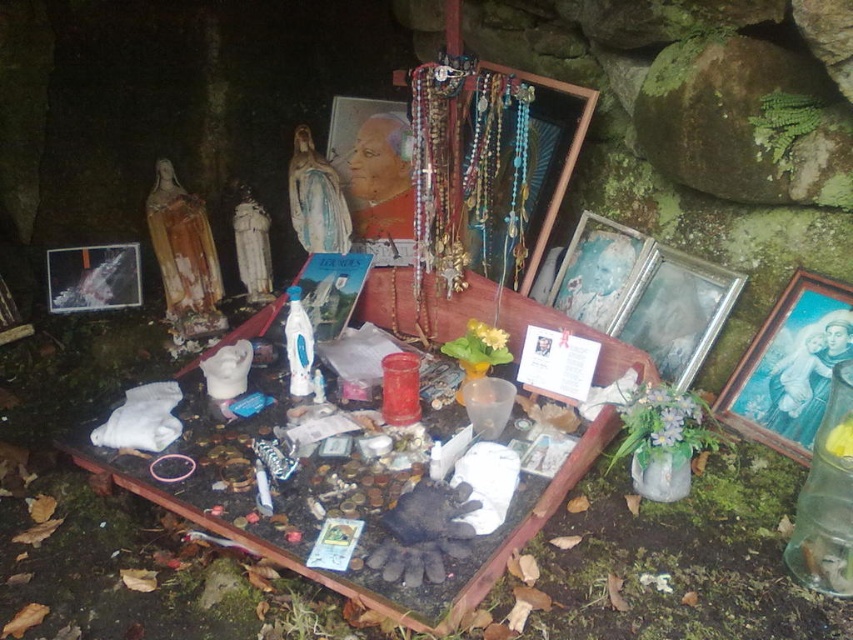
Question: Which of the following is the closest to the observer?

Choices:
 (A) (376, 122)
 (B) (96, 252)
 (C) (590, 228)

Answer: (C)

Question: Does matte wooden picture frame at center have a smaller size compared to yellow matte flower at center?

Choices:
 (A) yes
 (B) no

Answer: (B)

Question: Among these objects, which one is farthest from the camera?

Choices:
 (A) metallic silver photo frame at left
 (B) matte wooden picture frame at center
 (C) yellow matte flower at center

Answer: (B)

Question: Where is matte wooden picture frame at center located in relation to wooden picture frame at center in the image?

Choices:
 (A) above
 (B) below

Answer: (A)

Question: Which object is farther from the camera taking this photo?

Choices:
 (A) wooden picture frame at center
 (B) green matte flower at center
 (C) wooden painted picture frame at right
 (D) yellow matte flower at center

Answer: (A)

Question: Is metallic silver picture frame at right bigger than yellow matte flower at center?

Choices:
 (A) yes
 (B) no

Answer: (A)